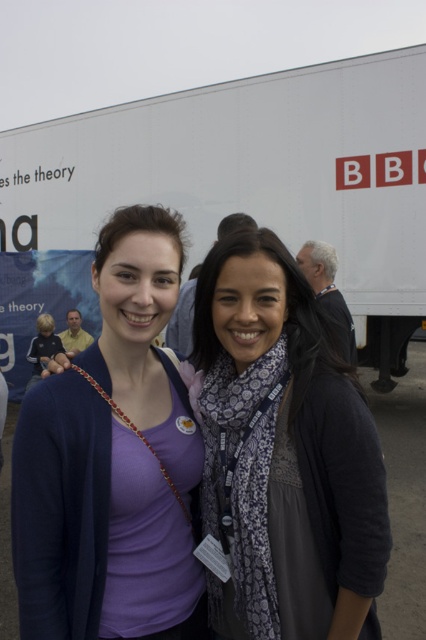
Question: Is matte purple shirt at center below patterned scarf at center?

Choices:
 (A) no
 (B) yes

Answer: (A)

Question: Which point is farther to the camera?

Choices:
 (A) pyautogui.click(x=250, y=369)
 (B) pyautogui.click(x=166, y=435)

Answer: (B)

Question: Which point is closer to the camera taking this photo?

Choices:
 (A) (383, 80)
 (B) (69, 472)

Answer: (B)

Question: Which of these objects is positioned closest to the white matte trailer truck at upper center?

Choices:
 (A) patterned scarf at center
 (B) matte purple shirt at center

Answer: (A)

Question: Does matte purple shirt at center have a smaller size compared to patterned scarf at center?

Choices:
 (A) no
 (B) yes

Answer: (B)

Question: Is white matte trailer truck at upper center above matte purple shirt at center?

Choices:
 (A) yes
 (B) no

Answer: (A)